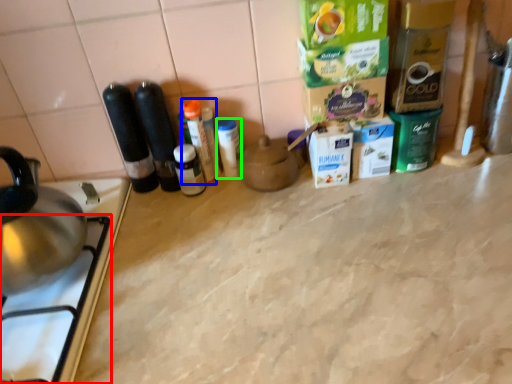
Question: Which object is positioned farthest from gas stove (highlighted by a red box)? Select from bottle (highlighted by a blue box) and bottle (highlighted by a green box).

Choices:
 (A) bottle
 (B) bottle

Answer: (B)